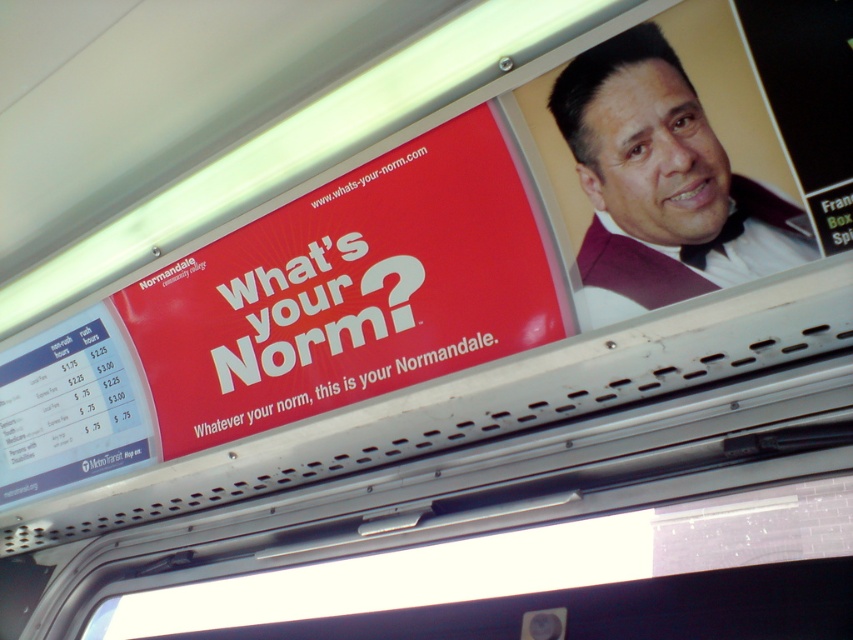
Which of these two, matte red sign at upper center or maroon textured vest at upper right, stands taller?

matte red sign at upper center is taller.

Does matte red sign at upper center come behind maroon textured vest at upper right?

Yes, it is behind maroon textured vest at upper right.

Image resolution: width=853 pixels, height=640 pixels. Describe the element at coordinates (349, 291) in the screenshot. I see `matte red sign at upper center` at that location.

At what (x,y) coordinates should I click in order to perform the action: click on matte red sign at upper center. Please return your answer as a coordinate pair (x, y). Looking at the image, I should click on pos(349,291).